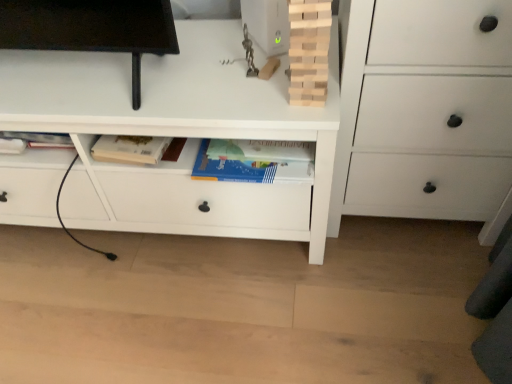
At what (x,y) coordinates should I click in order to perform the action: click on blank space situated above white matte chest of drawers at center, the second chest of drawers when ordered from right to left (from a real-world perspective). Please return your answer as a coordinate pair (x, y). Looking at the image, I should click on (124, 72).